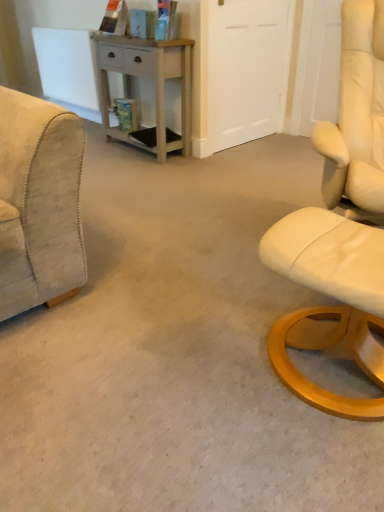
Question: Considering the positions of beige corduroy armchair at left and light gray wood desk at center in the image, is beige corduroy armchair at left bigger or smaller than light gray wood desk at center?

Choices:
 (A) big
 (B) small

Answer: (B)

Question: Is beige corduroy armchair at left situated inside light gray wood desk at center or outside?

Choices:
 (A) outside
 (B) inside

Answer: (A)

Question: Which is farther from the light gray wood desk at center?

Choices:
 (A) white matte door at upper center
 (B) beige corduroy armchair at left

Answer: (B)

Question: Which of these objects is positioned farthest from the beige corduroy armchair at left?

Choices:
 (A) white matte door at upper center
 (B) light gray wood desk at center

Answer: (A)